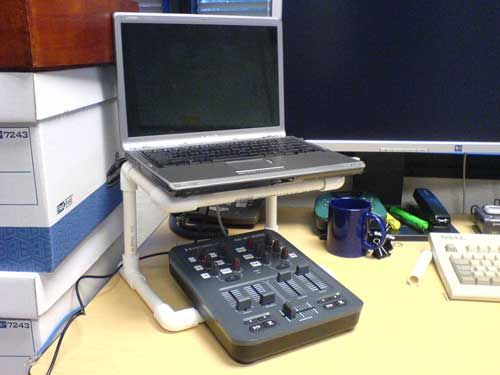
The image size is (500, 375). I want to click on white file box lid, so point(16,294), point(16,94).